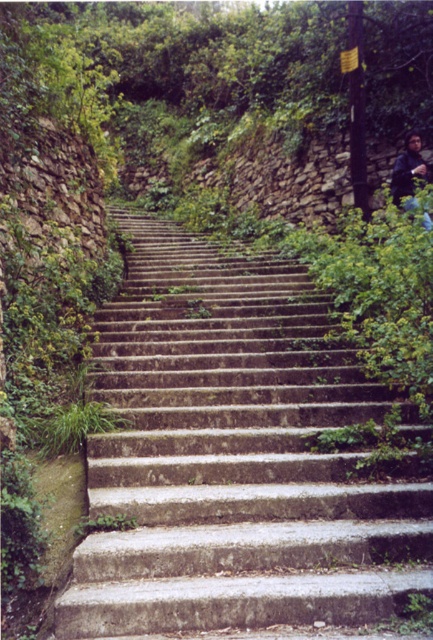
Can you confirm if gray concrete stairs at center is taller than dark blue fabric jacket at upper right?

No, gray concrete stairs at center is not taller than dark blue fabric jacket at upper right.

Looking at this image, is gray concrete stairs at center to the left of dark blue fabric jacket at upper right from the viewer's perspective?

Correct, you'll find gray concrete stairs at center to the left of dark blue fabric jacket at upper right.

I want to click on gray concrete stairs at center, so 233,460.

You are a GUI agent. You are given a task and a screenshot of the screen. Output one action in this format:
    pyautogui.click(x=<x>, y=<y>)
    Task: Click on the gray concrete stairs at center
    Image resolution: width=433 pixels, height=640 pixels.
    Given the screenshot: What is the action you would take?
    pyautogui.click(x=233, y=460)